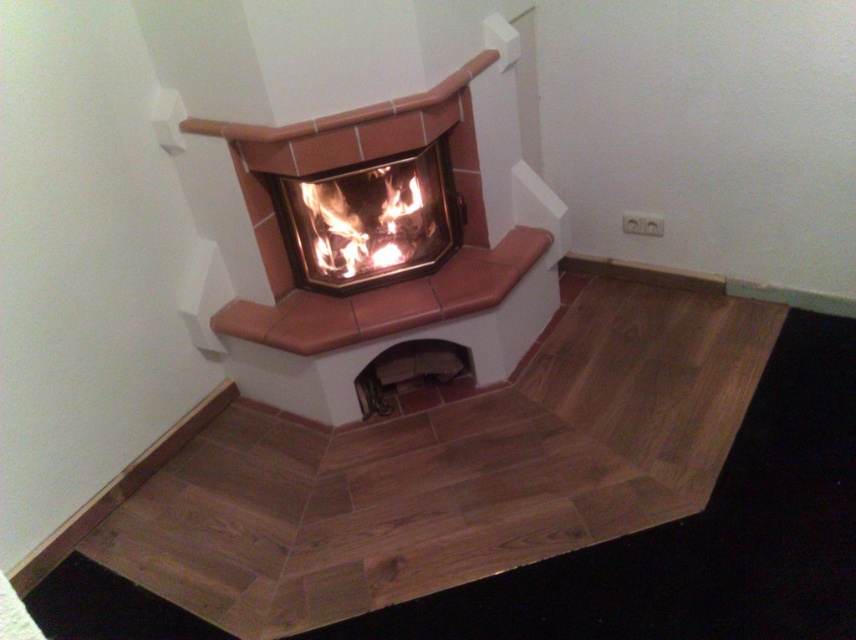
Which of these two, flaming wood at center or metallic dark gray vent at lower center, stands taller?

flaming wood at center

Consider the image. Who is more forward, (384, 196) or (418, 376)?

Point (384, 196) is more forward.

Locate an element on the screen. This screenshot has width=856, height=640. flaming wood at center is located at coordinates (363, 218).

Who is lower down, terracotta tile fireplace at center or matte ceramic fireplace at center?

terracotta tile fireplace at center is below.

Does point (254, 157) come farther from viewer compared to point (385, 208)?

No, it is not.

Locate an element on the screen. The height and width of the screenshot is (640, 856). terracotta tile fireplace at center is located at coordinates (424, 236).

Is matte ceramic fireplace at center below metallic dark gray vent at lower center?

No, matte ceramic fireplace at center is not below metallic dark gray vent at lower center.

Can you confirm if matte ceramic fireplace at center is positioned to the left of metallic dark gray vent at lower center?

Correct, you'll find matte ceramic fireplace at center to the left of metallic dark gray vent at lower center.

Image resolution: width=856 pixels, height=640 pixels. What do you see at coordinates (370, 220) in the screenshot?
I see `matte ceramic fireplace at center` at bounding box center [370, 220].

This screenshot has width=856, height=640. In order to click on matte ceramic fireplace at center in this screenshot , I will do `click(370, 220)`.